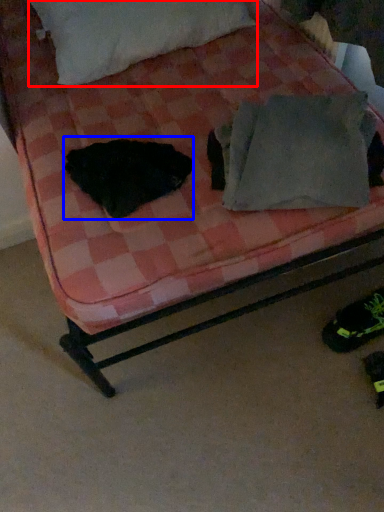
Question: Among these objects, which one is farthest to the camera, pillow (highlighted by a red box) or animal (highlighted by a blue box)?

Choices:
 (A) pillow
 (B) animal

Answer: (A)